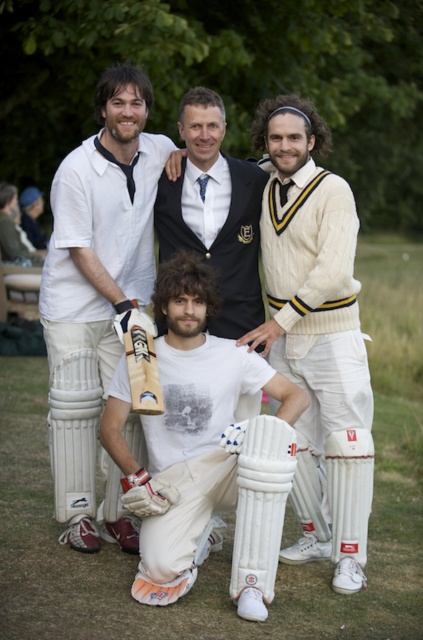
Question: Which of the following is the farthest from the observer?

Choices:
 (A) white leather cricket pads at center
 (B) cable-knit sweater at center
 (C) white matte cricket bat at center

Answer: (C)

Question: Which object is closer to the camera taking this photo?

Choices:
 (A) cable-knit sweater at center
 (B) white matte cricket bat at center

Answer: (A)

Question: Which object appears closest to the camera in this image?

Choices:
 (A) cable-knit sweater at center
 (B) white leather cricket bat at center
 (C) white leather cricket pads at center

Answer: (B)

Question: Does white leather cricket pads at center have a larger size compared to cable-knit sweater at center?

Choices:
 (A) no
 (B) yes

Answer: (B)

Question: Considering the relative positions of white leather cricket bat at center and white textured cricket bat at center in the image provided, where is white leather cricket bat at center located with respect to white textured cricket bat at center?

Choices:
 (A) right
 (B) left

Answer: (B)

Question: Is white leather cricket pads at center wider than white textured cricket bat at center?

Choices:
 (A) yes
 (B) no

Answer: (A)